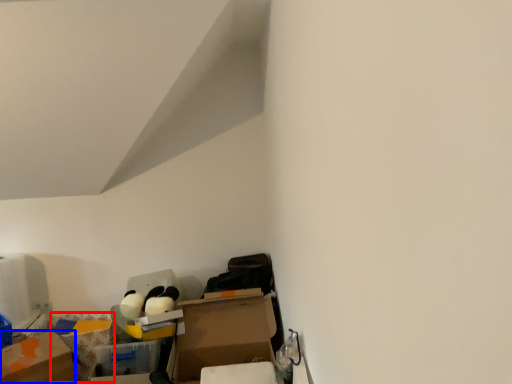
Question: Which object appears farthest to the camera in this image, storage box (highlighted by a red box) or cardboard box (highlighted by a blue box)?

Choices:
 (A) storage box
 (B) cardboard box

Answer: (A)